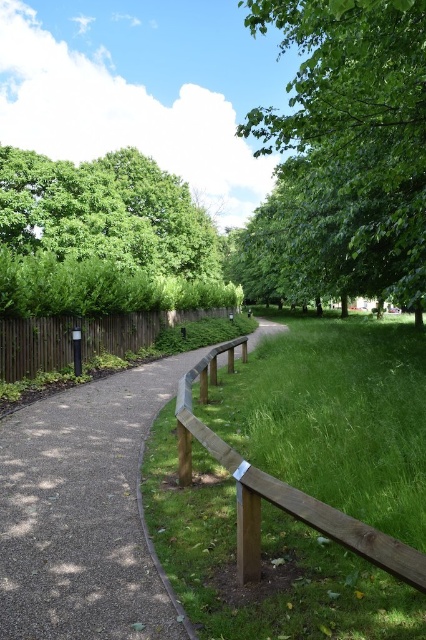
Question: Estimate the real-world distances between objects in this image. Which object is farther from the green leafy tree at upper left?

Choices:
 (A) brown gravel path at center
 (B) green leafy tree at upper center
 (C) green grass at center
 (D) brown wooden fence at left

Answer: (A)

Question: Considering the relative positions of brown gravel path at center and brown wooden fence at left in the image provided, where is brown gravel path at center located with respect to brown wooden fence at left?

Choices:
 (A) below
 (B) above

Answer: (A)

Question: Among these points, which one is nearest to the camera?

Choices:
 (A) (83, 193)
 (B) (359, 61)

Answer: (B)

Question: Is green grass at center thinner than brown wooden fence at left?

Choices:
 (A) no
 (B) yes

Answer: (A)

Question: Is brown gravel path at center wider than green leafy tree at upper left?

Choices:
 (A) yes
 (B) no

Answer: (B)

Question: Which point appears closest to the camera in this image?

Choices:
 (A) (400, 292)
 (B) (42, 352)
 (C) (6, 182)

Answer: (A)